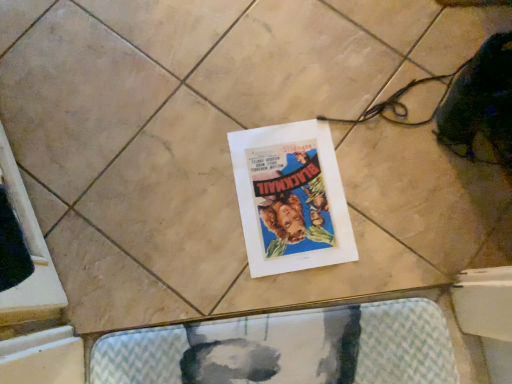
At what (x,y) coordinates should I click in order to perform the action: click on spots to the right of matte paper comic book at center. Please return your answer as a coordinate pair (x, y). Image resolution: width=512 pixels, height=384 pixels. Looking at the image, I should click on (399, 195).